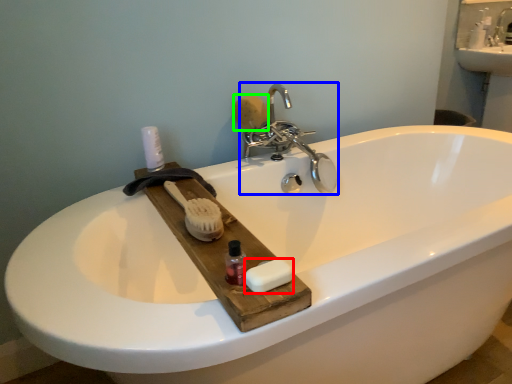
Question: Estimate the real-world distances between objects in this image. Which object is closer to soap (highlighted by a red box), tap (highlighted by a blue box) or soap (highlighted by a green box)?

Choices:
 (A) tap
 (B) soap

Answer: (A)